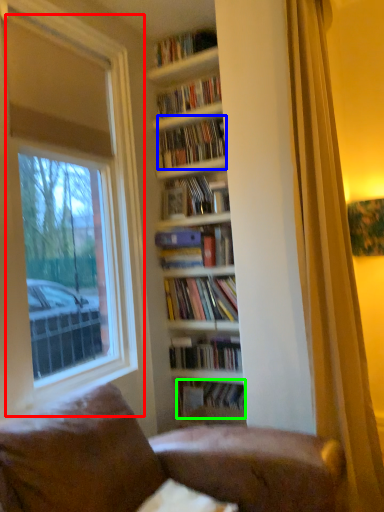
Question: Estimate the real-world distances between objects in this image. Which object is closer to window (highlighted by a red box), book (highlighted by a blue box) or book (highlighted by a green box)?

Choices:
 (A) book
 (B) book

Answer: (A)